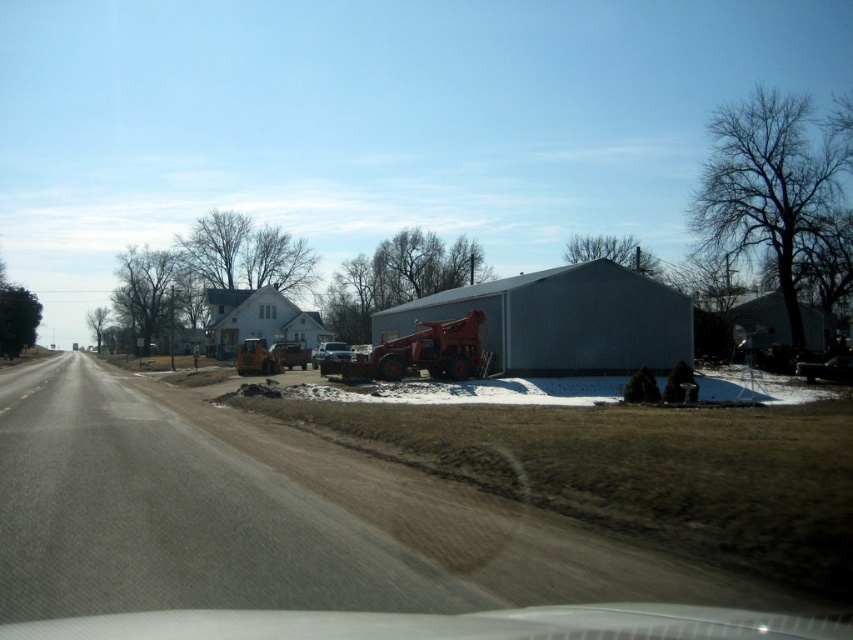
Question: Is gray metallic barn at center thinner than white matte house at center?

Choices:
 (A) no
 (B) yes

Answer: (B)

Question: Among these objects, which one is nearest to the camera?

Choices:
 (A) metallic yellow tractor at center
 (B) white matte house at center

Answer: (A)

Question: Which object is positioned closest to the metallic yellow tractor at center?

Choices:
 (A) white matte house at center
 (B) rusty metal tractor at center
 (C) gray metallic barn at center
 (D) dirt track at lower left

Answer: (A)

Question: Is gray metallic barn at center thinner than metallic yellow tractor at center?

Choices:
 (A) no
 (B) yes

Answer: (A)

Question: Which point is closer to the camera taking this photo?

Choices:
 (A) (308, 316)
 (B) (402, 369)
 (C) (248, 340)
 (D) (405, 307)

Answer: (B)

Question: Does dirt track at lower left have a smaller size compared to gray metallic barn at center?

Choices:
 (A) no
 (B) yes

Answer: (A)